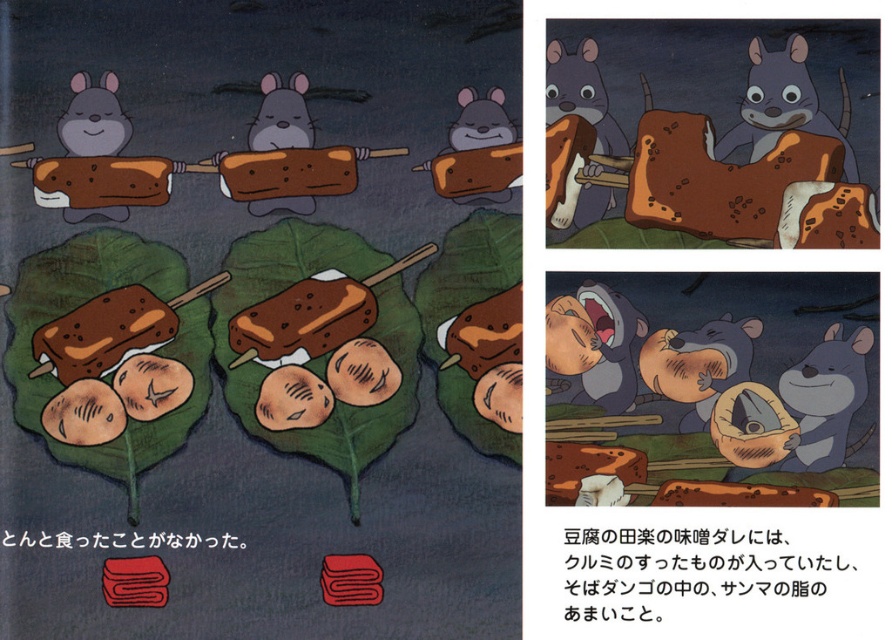
Is brown matte bread at center wider than brown matte skewered food at upper left?

Correct, the width of brown matte bread at center exceeds that of brown matte skewered food at upper left.

Which is in front, point (653, 486) or point (56, 202)?

Point (653, 486) is in front.

Between point (681, 465) and point (42, 157), which one is positioned behind?

Positioned behind is point (681, 465).

The image size is (892, 640). What are the coordinates of `brown matte bread at center` in the screenshot? It's located at (711, 388).

Does gray furry mouse at lower right appear on the left side of matte gray mouse at upper left?

No, gray furry mouse at lower right is not to the left of matte gray mouse at upper left.

Which is in front, point (866, 342) or point (76, 93)?

Point (76, 93) is more forward.

Find the location of a particular element. The image size is (892, 640). gray furry mouse at lower right is located at coordinates (824, 397).

Who is more distant from viewer, (783, 403) or (350, 276)?

Point (350, 276)

Does brown matte bread at center have a lesser height compared to brown matte ice cream bar at center?

No, brown matte bread at center is not shorter than brown matte ice cream bar at center.

Which is behind, point (765, 493) or point (266, 352)?

The point (266, 352) is behind.

At what (x,y) coordinates should I click in order to perform the action: click on brown matte bread at center. Please return your answer as a coordinate pair (x, y). Looking at the image, I should click on (711, 388).